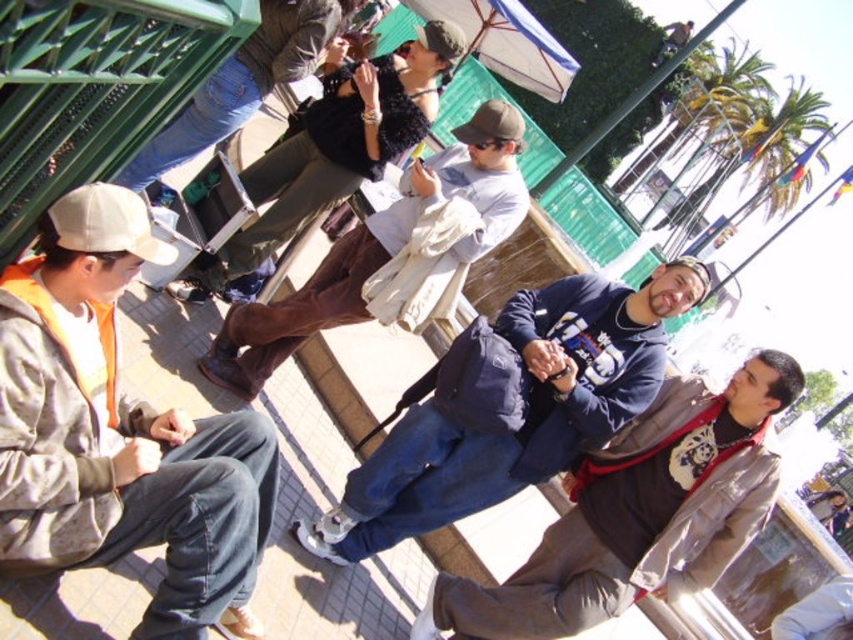
You are trying to decide which item to pack for a quick trip. You can only choose between the jeans at upper left and the matte brown baseball cap at center. Based on their sizes, which one takes up more space?

The jeans at upper left takes up more space because its width is larger than the matte brown baseball cap at center.

You are standing at the center of the image and want to find the jeans at upper left. According to the coordinates provided, in which direction should you look to locate them?

The jeans at upper left is located at point coordinates with x 0.131 and y 0.284. Since the x value is less than 0.5 and the y value is less than 0.5, the jeans is positioned to the left and lower half of the image. Therefore, you should look towards the upper left direction to locate them.

You are standing at the location of the person in dark brown leather pants at center. You want to throw a frisbee to the person in beige cap on the left. Can you reach them with a single throw?

The distance between the person in dark brown leather pants at center and the person in beige cap on the left is 24.13 meters. Since the average throwing distance for a frisbee is around 30 meters, it might be challenging but possible with a strong throw.